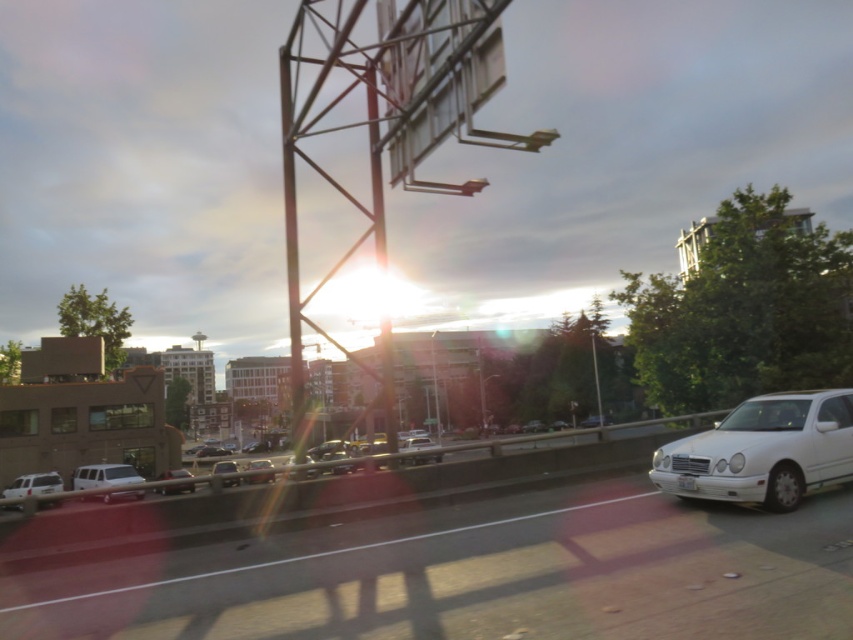
Between white glossy sedan at right and matte black sedan at center, which one appears on the left side from the viewer's perspective?

matte black sedan at center is more to the left.

Is white glossy sedan at right positioned behind matte black sedan at center?

That is False.

Does point (769, 476) come behind point (163, 477)?

No, it is in front of (163, 477).

Where is `white glossy sedan at right`? The width and height of the screenshot is (853, 640). white glossy sedan at right is located at coordinates (764, 451).

Who is lower down, white glossy car at center or matte white van at center?

matte white van at center

Is white glossy car at center bigger than matte white van at center?

Incorrect, white glossy car at center is not larger than matte white van at center.

Is point (767, 556) farther from camera compared to point (128, 467)?

No, it is in front of (128, 467).

Locate an element on the screen. white glossy car at center is located at coordinates (445, 566).

Does metallic silver sedan at center have a lesser width compared to white plastic license plate at center?

No, metallic silver sedan at center is not thinner than white plastic license plate at center.

Is point (231, 472) positioned in front of point (691, 483)?

No.

This screenshot has width=853, height=640. What are the coordinates of `metallic silver sedan at center` in the screenshot? It's located at (224, 467).